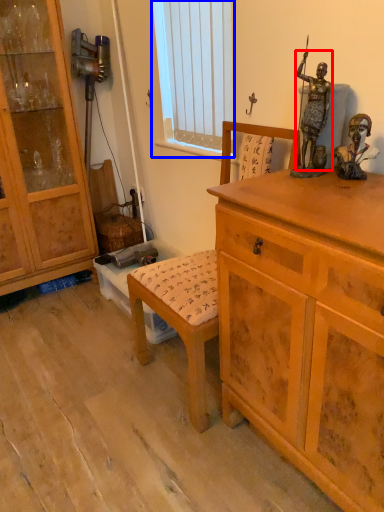
Question: Which object is further to the camera taking this photo, person (highlighted by a red box) or window screen (highlighted by a blue box)?

Choices:
 (A) person
 (B) window screen

Answer: (B)